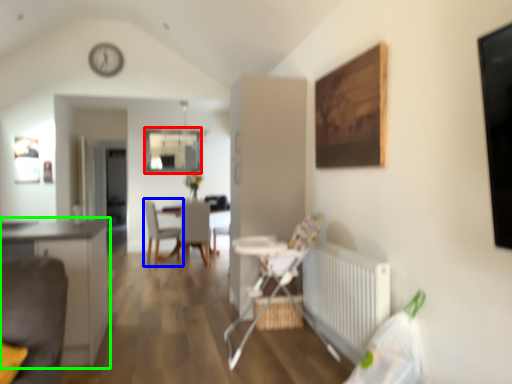
Question: Based on their relative distances, which object is nearer to window (highlighted by a red box)? Choose from chair (highlighted by a blue box) and cabinetry (highlighted by a green box).

Choices:
 (A) chair
 (B) cabinetry

Answer: (A)